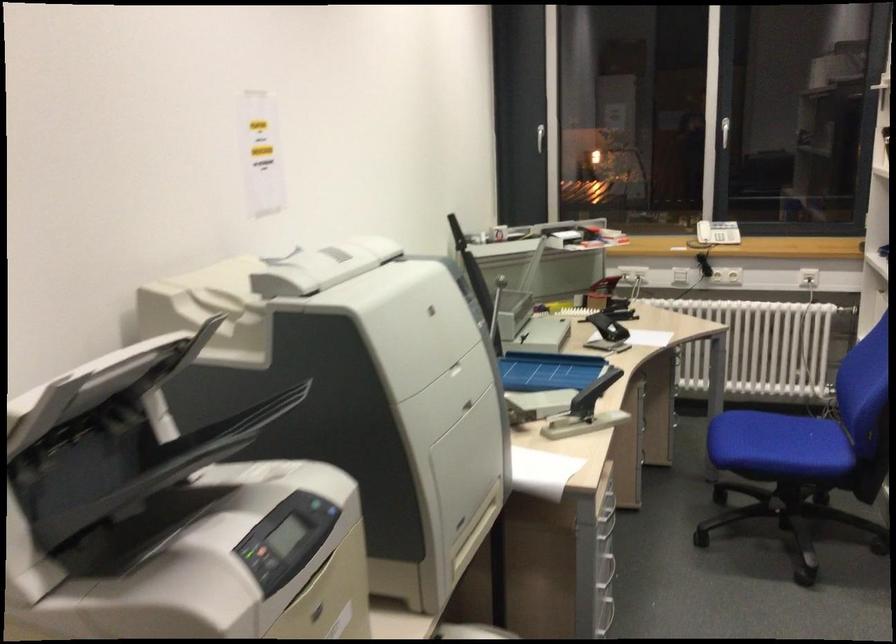
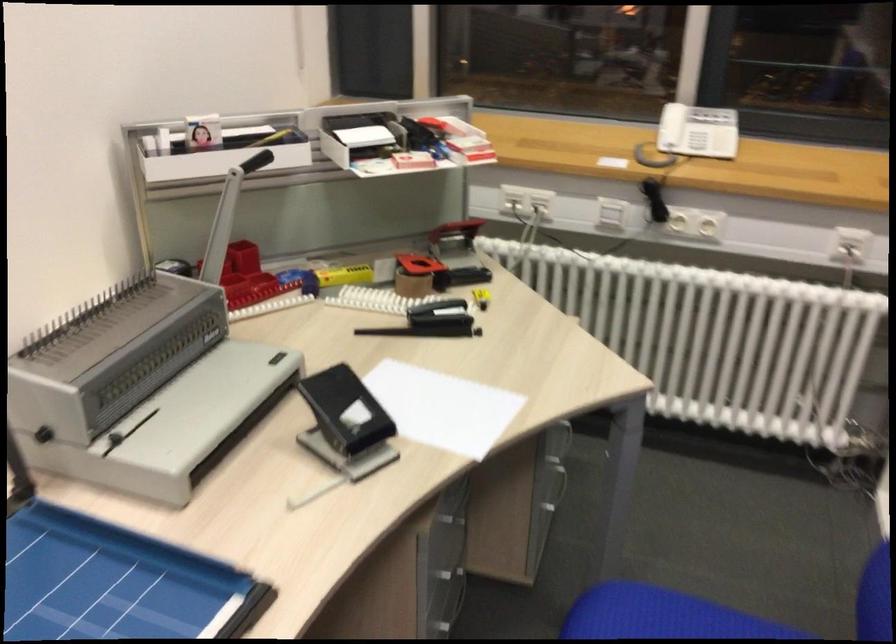
In the second image, find the point that corresponds to (599,294) in the first image.

(414, 272)